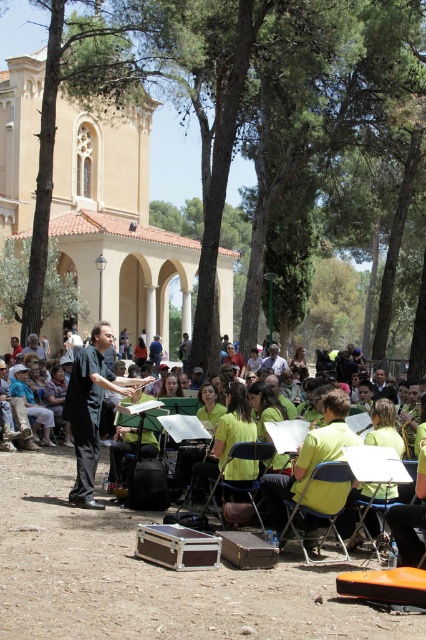
Question: Estimate the real-world distances between objects in this image. Which object is farther from the yellow fabric chair at lower center?

Choices:
 (A) light brown leather shoes at lower center
 (B) metallic silver chair at lower center
 (C) black smooth conductor at center

Answer: (A)

Question: Does yellow fabric chair at lower center appear on the left side of metallic silver chair at lower center?

Choices:
 (A) yes
 (B) no

Answer: (A)

Question: Can you confirm if green leafy tree at center is positioned above black smooth conductor at center?

Choices:
 (A) yes
 (B) no

Answer: (A)

Question: Which object is farther from the camera taking this photo?

Choices:
 (A) metallic silver chair at lower center
 (B) green leafy tree at center
 (C) yellow fabric chair at lower center
 (D) yellow fabric chair at center

Answer: (B)

Question: Which is nearer to the green leafy tree at center?

Choices:
 (A) metallic silver chair at lower center
 (B) yellow fabric chair at lower center
 (C) yellow fabric chair at center
 (D) light brown leather shoes at lower center

Answer: (D)

Question: Does green leafy tree at center appear over black smooth conductor at center?

Choices:
 (A) no
 (B) yes

Answer: (B)